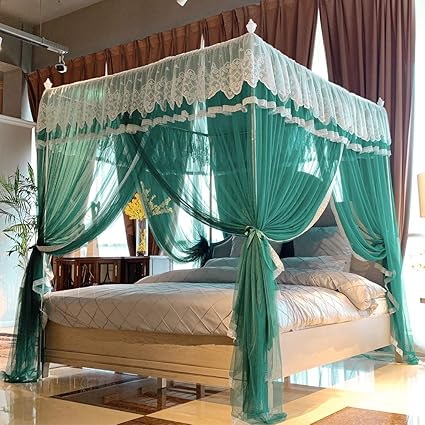
Find the location of a particular element. The height and width of the screenshot is (425, 425). teal curtain is located at coordinates (220, 162).